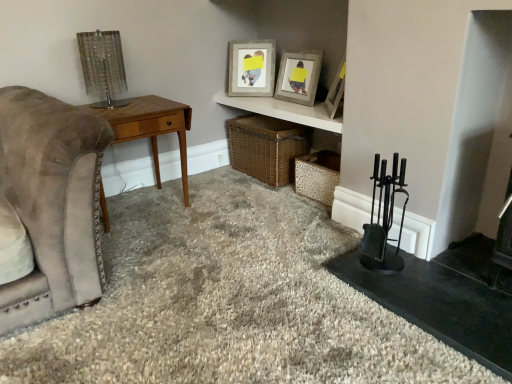
Question: In the image, is metallic textured crate at lower right, which is the 1th crate in right-to-left order, positioned in front of or behind metallic mesh lamp at upper left?

Choices:
 (A) front
 (B) behind

Answer: (B)

Question: Looking at the image, does metallic textured crate at lower right, which is the 1th crate in right-to-left order, seem bigger or smaller compared to metallic mesh lamp at upper left?

Choices:
 (A) small
 (B) big

Answer: (B)

Question: Estimate the real-world distances between objects in this image. Which object is farther from the metallic mesh lamp at upper left?

Choices:
 (A) wooden picture frame at upper center, which appears as the first picture frame when viewed from the right
 (B) wooden desk at left
 (C) woven brown basket at center, the second crate in the right-to-left sequence
 (D) wooden picture frame at upper center, which is counted as the first picture frame, starting from the left
 (E) wooden picture frame at upper center, the second picture frame in the left-to-right sequence

Answer: (A)

Question: Which is farther from the metallic mesh lamp at upper left?

Choices:
 (A) metallic textured crate at lower right, arranged as the 2th crate when viewed from the left
 (B) woven brown basket at center, which ranks as the first crate in left-to-right order
 (C) wooden desk at left
 (D) matte wooden shelf at upper center
 (E) wooden picture frame at upper center, which ranks as the third picture frame in left-to-right order

Answer: (E)